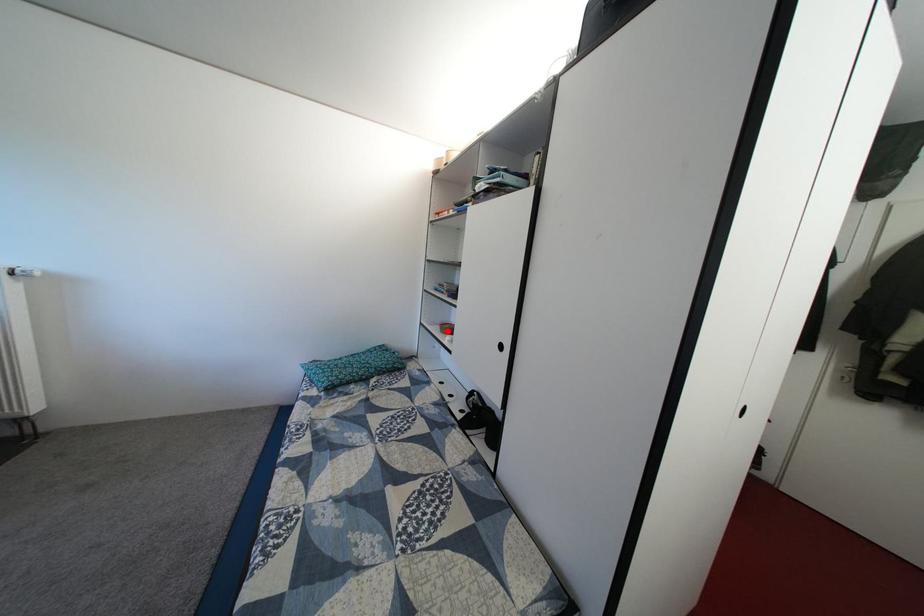
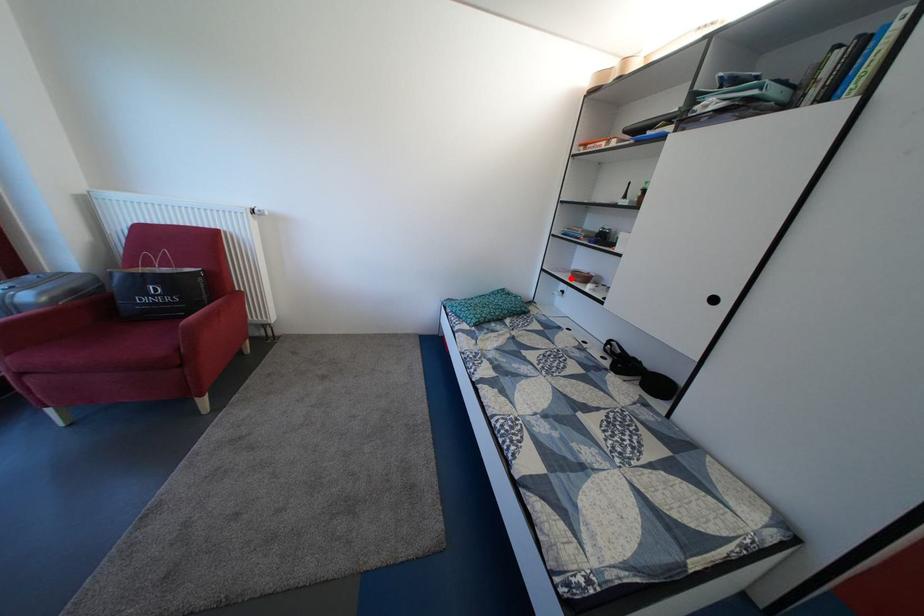
I am providing you with two images of the same scene from different viewpoints. A red point is marked on the first image and another point is marked on the second image. Is the marked point in image1 the same physical position as the marked point in image2?

Yes